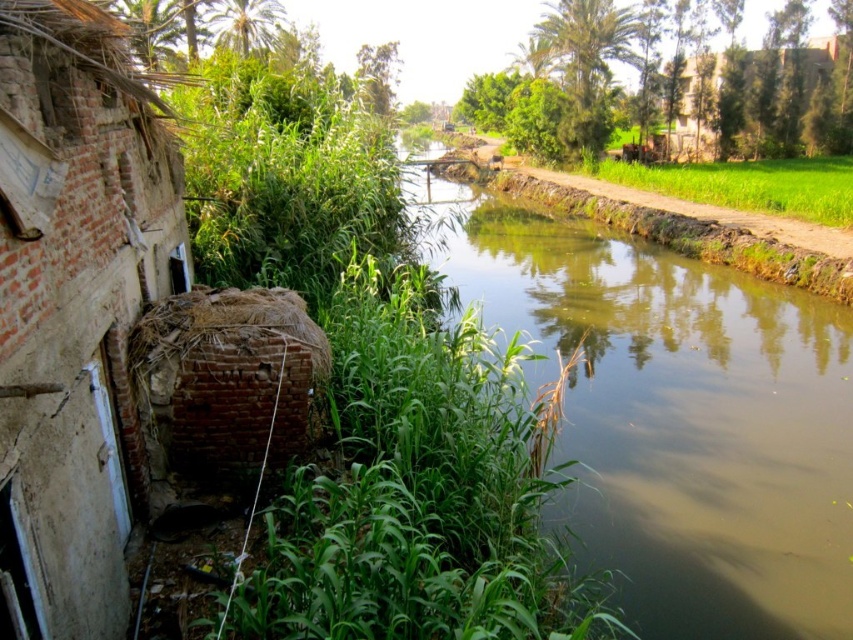
You are a photographer standing at the edge of the canal and want to take a photo that includes both the brick wall at left and the green grass at right. Based on their positions, which object will appear closer to the camera in the photo?

The brick wall at left will appear closer to the camera in the photo because it is positioned in front of the green grass at right.

You are standing at the edge of the canal looking towards the brick wall at left and the green grass at right. Which object is closer to the water surface?

The brick wall at left is closer to the water surface because it is positioned below the green grass at right.